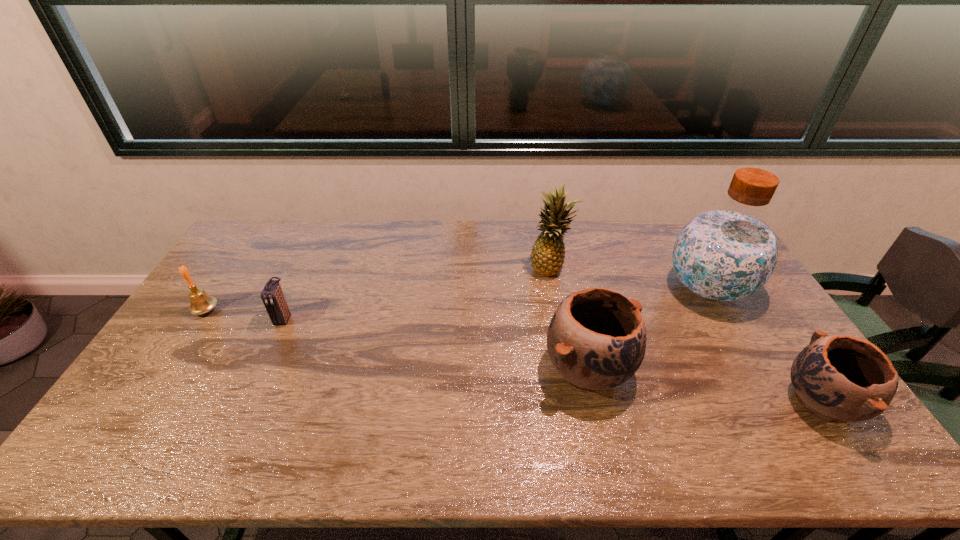
Find the location of a particular element. This screenshot has width=960, height=540. free spot located 0.190m on the left of the water jug is located at coordinates (605, 288).

You are a GUI agent. You are given a task and a screenshot of the screen. Output one action in this format:
    pyautogui.click(x=<x>, y=<y>)
    Task: Click on the free space located on the left of the fifth shortest object
    The width and height of the screenshot is (960, 540).
    Given the screenshot: What is the action you would take?
    pyautogui.click(x=452, y=267)

What are the coordinates of `vacant space situated 0.130m with the zip open on the shortest object` in the screenshot? It's located at (263, 364).

Find the location of `vacant space positioned 0.390m on the right of the bell`. vacant space positioned 0.390m on the right of the bell is located at coordinates (343, 310).

What are the coordinates of `object positioned at the far edge` in the screenshot? It's located at (548, 253).

Find the location of `object located at the left edge`. object located at the left edge is located at coordinates (201, 302).

Image resolution: width=960 pixels, height=540 pixels. In order to click on pottery located in the right edge section of the desktop in this screenshot , I will do `click(838, 378)`.

At what (x,y) coordinates should I click in order to perform the action: click on water jug present at the right edge. Please return your answer as a coordinate pair (x, y). Image resolution: width=960 pixels, height=540 pixels. Looking at the image, I should click on (728, 253).

Where is `object located at the near right corner`? The image size is (960, 540). object located at the near right corner is located at coordinates (838, 378).

You are a GUI agent. You are given a task and a screenshot of the screen. Output one action in this format:
    pyautogui.click(x=<x>, y=<y>)
    Task: Click on the free space at the far edge of the desktop
    
    Given the screenshot: What is the action you would take?
    pyautogui.click(x=436, y=232)